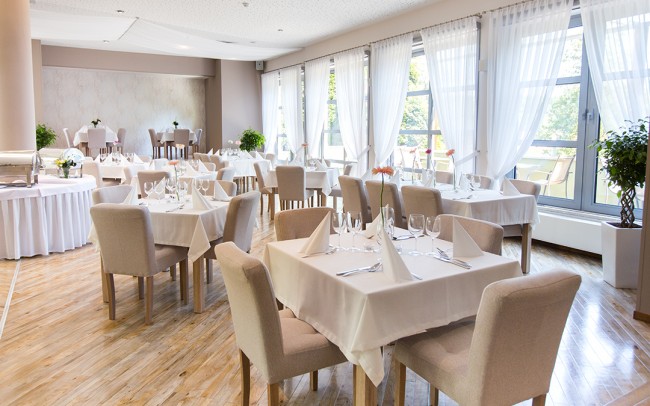
Locate an element on the screen. This screenshot has height=406, width=650. windows is located at coordinates (556, 101), (410, 116), (333, 120), (280, 104).